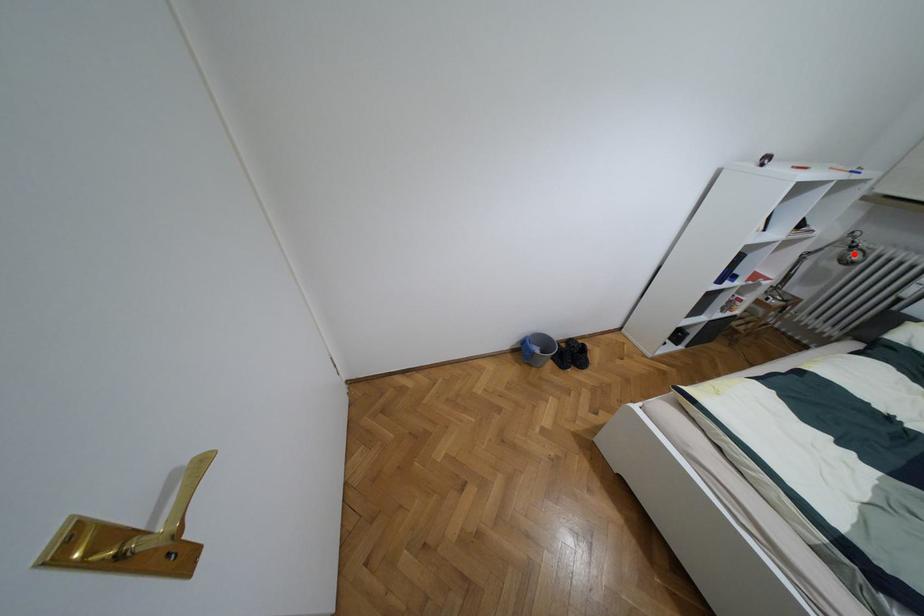
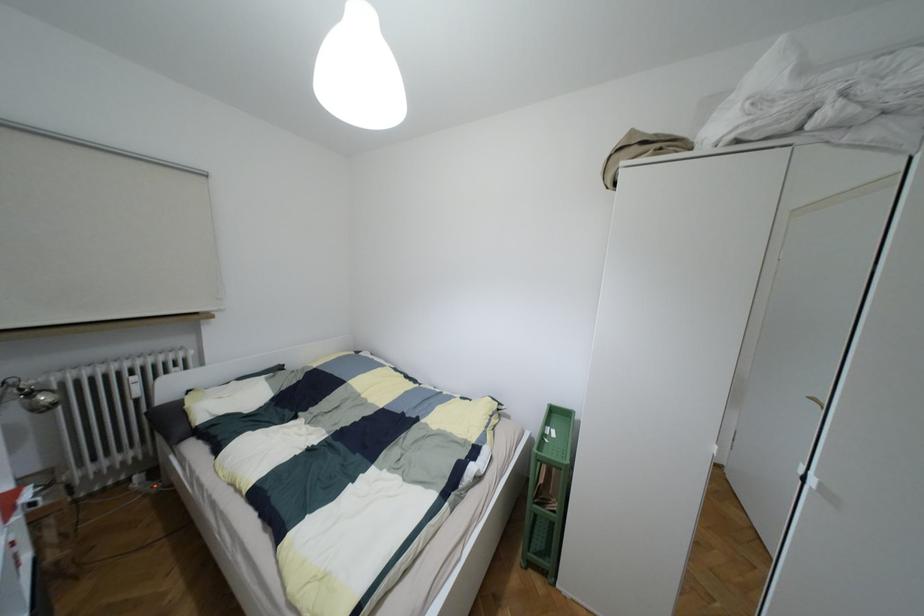
Where in the second image is the point corresponding to the highlighted location from the first image?

(43, 397)